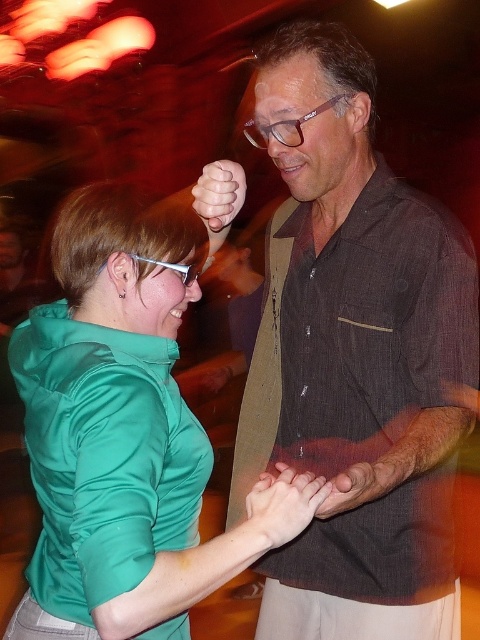
Question: Does matte skin hand at center appear on the left side of clear plastic glasses at upper left?

Choices:
 (A) yes
 (B) no

Answer: (B)

Question: Which object is the farthest from the clear plastic glasses at upper left?

Choices:
 (A) transparent plastic glasses at center
 (B) brown textured shirt at center

Answer: (B)

Question: Where is brown textured shirt at center located in relation to transparent plastic glasses at center in the image?

Choices:
 (A) right
 (B) left

Answer: (A)

Question: Which point is farther from the camera taking this photo?

Choices:
 (A) tap(159, 260)
 (B) tap(241, 435)
 (C) tap(216, 168)
 (D) tap(312, 484)

Answer: (B)

Question: Which object is closer to the camera taking this photo?

Choices:
 (A) matte skin hand at center
 (B) clear plastic glasses at upper left
 (C) brown textured shirt at center

Answer: (C)

Question: Can you confirm if green satin blouse at center is positioned to the right of transparent plastic glasses at center?

Choices:
 (A) yes
 (B) no

Answer: (B)